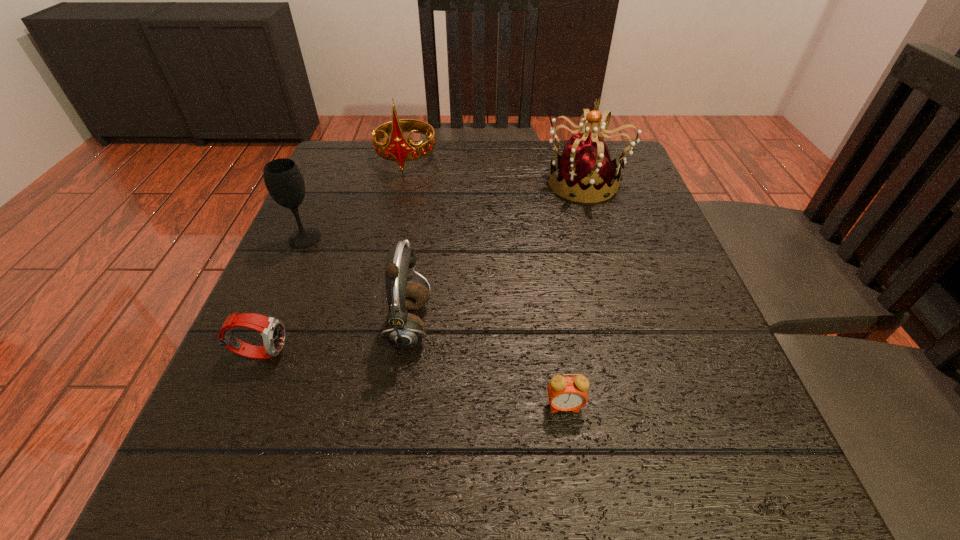
Locate an element on the screen. The image size is (960, 540). object at the far right corner is located at coordinates (585, 171).

The width and height of the screenshot is (960, 540). In the image, there is a desktop. Identify the location of vacant space at the far edge. coord(481,140).

Find the location of a particular element. The width and height of the screenshot is (960, 540). vacant region at the near edge of the desktop is located at coordinates (467, 509).

The height and width of the screenshot is (540, 960). Identify the location of free space at the left edge of the desktop. (298, 251).

Identify the location of free location at the right edge. This screenshot has height=540, width=960. (695, 352).

In the image, there is a desktop. At what (x,y) coordinates should I click in order to perform the action: click on vacant space at the far left corner. Please return your answer as a coordinate pair (x, y). The width and height of the screenshot is (960, 540). Looking at the image, I should click on (327, 183).

Where is `blank space at the far right corner of the desktop`? This screenshot has height=540, width=960. blank space at the far right corner of the desktop is located at coordinates (630, 192).

Locate an element on the screen. The image size is (960, 540). free space between the fourth nearest object and the left tiara is located at coordinates (355, 198).

At what (x,y) coordinates should I click in order to perform the action: click on vacant point located between the earphone and the rightmost object. Please return your answer as a coordinate pair (x, y). The image size is (960, 540). Looking at the image, I should click on (498, 254).

Identify the location of free space that is in between the watch and the earphone. Image resolution: width=960 pixels, height=540 pixels. (335, 339).